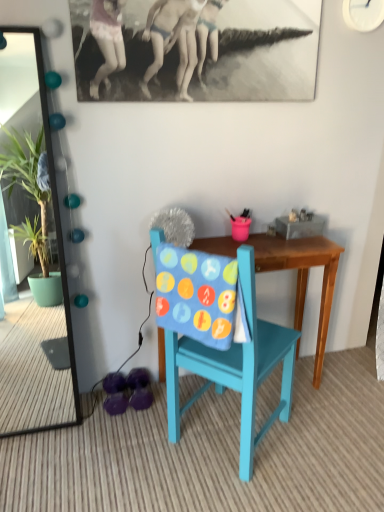
Locate an element on the screen. vacant area that is in front of teal painted wood chair at center is located at coordinates (236, 490).